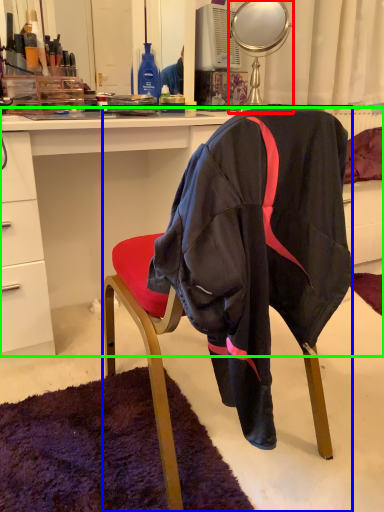
Question: Which is nearer to the mirror (highlighted by a red box)? chair (highlighted by a blue box) or desk (highlighted by a green box).

Choices:
 (A) chair
 (B) desk

Answer: (B)